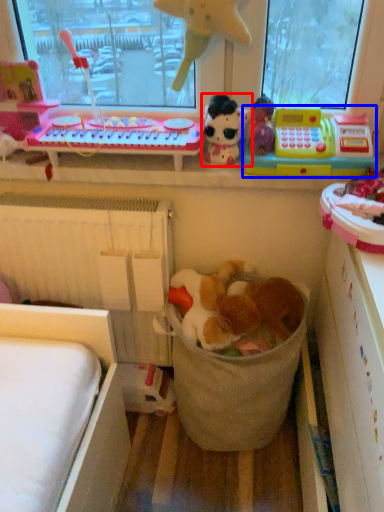
Question: Which of the following is the closest to the observer, toy (highlighted by a red box) or toy (highlighted by a blue box)?

Choices:
 (A) toy
 (B) toy

Answer: (B)